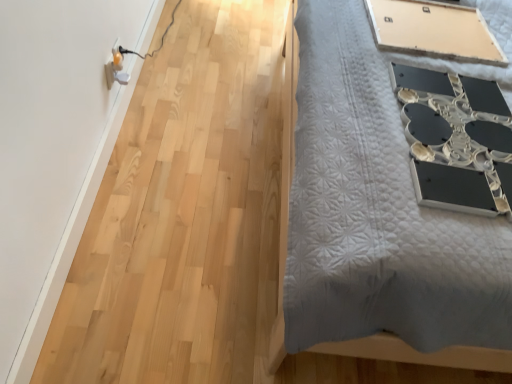
At what (x,y) coordinates should I click in order to perform the action: click on matte beige board at upper right. Please return your answer as a coordinate pair (x, y). This screenshot has width=512, height=384. Looking at the image, I should click on (434, 30).

What do you see at coordinates (434, 30) in the screenshot? I see `matte beige board at upper right` at bounding box center [434, 30].

Describe the element at coordinates (117, 57) in the screenshot. The height and width of the screenshot is (384, 512). I see `white plastic electric outlet at upper left` at that location.

Locate an element on the screen. white plastic electric outlet at upper left is located at coordinates (117, 57).

Locate an element on the screen. matte beige board at upper right is located at coordinates (434, 30).

Between white plastic electric outlet at upper left and matte beige board at upper right, which one appears on the right side from the viewer's perspective?

From the viewer's perspective, matte beige board at upper right appears more on the right side.

Is white plastic electric outlet at upper left in front of matte beige board at upper right?

No, it is not.

Is point (114, 63) positioned behind point (406, 46)?

Yes, it is behind point (406, 46).

From the image's perspective, which is below, white plastic electric outlet at upper left or matte beige board at upper right?

white plastic electric outlet at upper left is shown below in the image.

From a real-world perspective, which is physically above, white plastic electric outlet at upper left or matte beige board at upper right?

From a 3D spatial view, matte beige board at upper right is above.

Which object is thinner, white plastic electric outlet at upper left or matte beige board at upper right?

white plastic electric outlet at upper left.

Between white plastic electric outlet at upper left and matte beige board at upper right, which one has less height?

matte beige board at upper right is shorter.

Is white plastic electric outlet at upper left bigger than matte beige board at upper right?

Incorrect, white plastic electric outlet at upper left is not larger than matte beige board at upper right.

In the scene shown: Is white plastic electric outlet at upper left completely or partially outside of matte beige board at upper right?

Absolutely, white plastic electric outlet at upper left is external to matte beige board at upper right.

Is white plastic electric outlet at upper left not near matte beige board at upper right?

Absolutely, white plastic electric outlet at upper left is distant from matte beige board at upper right.

Is white plastic electric outlet at upper left aimed at matte beige board at upper right?

Yes.

How many degrees apart are the facing directions of white plastic electric outlet at upper left and matte beige board at upper right?

The angular difference between white plastic electric outlet at upper left and matte beige board at upper right is 174 degrees.

How much distance is there between white plastic electric outlet at upper left and matte beige board at upper right?

white plastic electric outlet at upper left and matte beige board at upper right are 1.10 meters apart.

What are the coordinates of `table above the white plastic electric outlet at upper left (from a real-world perspective)` in the screenshot? It's located at (434, 30).

Is matte beige board at upper right at the right side of white plastic electric outlet at upper left?

Yes, matte beige board at upper right is to the right of white plastic electric outlet at upper left.

Which object is closer to the camera, matte beige board at upper right or white plastic electric outlet at upper left?

matte beige board at upper right is in front.

Considering the points (370, 9) and (115, 53), which point is behind, point (370, 9) or point (115, 53)?

The point (115, 53) is more distant.

From the image's perspective, between matte beige board at upper right and white plastic electric outlet at upper left, who is located below?

white plastic electric outlet at upper left, from the image's perspective.

From the picture: From a real-world perspective, is matte beige board at upper right positioned over white plastic electric outlet at upper left based on gravity?

Correct, in the physical world, matte beige board at upper right is higher than white plastic electric outlet at upper left.

Which object is thinner, matte beige board at upper right or white plastic electric outlet at upper left?

white plastic electric outlet at upper left.

Does matte beige board at upper right have a lesser height compared to white plastic electric outlet at upper left?

Correct, matte beige board at upper right is not as tall as white plastic electric outlet at upper left.

Is matte beige board at upper right bigger than white plastic electric outlet at upper left?

Correct, matte beige board at upper right is larger in size than white plastic electric outlet at upper left.

Is matte beige board at upper right not inside white plastic electric outlet at upper left?

Yes, matte beige board at upper right is located beyond the bounds of white plastic electric outlet at upper left.

Is matte beige board at upper right far away from white plastic electric outlet at upper left?

Absolutely, matte beige board at upper right is distant from white plastic electric outlet at upper left.

Is matte beige board at upper right oriented away from white plastic electric outlet at upper left?

No.

How different are the orientations of matte beige board at upper right and white plastic electric outlet at upper left in degrees?

There is a 174-degree angle between the facing directions of matte beige board at upper right and white plastic electric outlet at upper left.

Where is `table above the white plastic electric outlet at upper left (from the image's perspective)`? The height and width of the screenshot is (384, 512). table above the white plastic electric outlet at upper left (from the image's perspective) is located at coordinates (434, 30).

Image resolution: width=512 pixels, height=384 pixels. I want to click on table located on the right of white plastic electric outlet at upper left, so click(x=434, y=30).

Identify the location of electric outlet that is below the matte beige board at upper right (from the image's perspective). The image size is (512, 384). (117, 57).